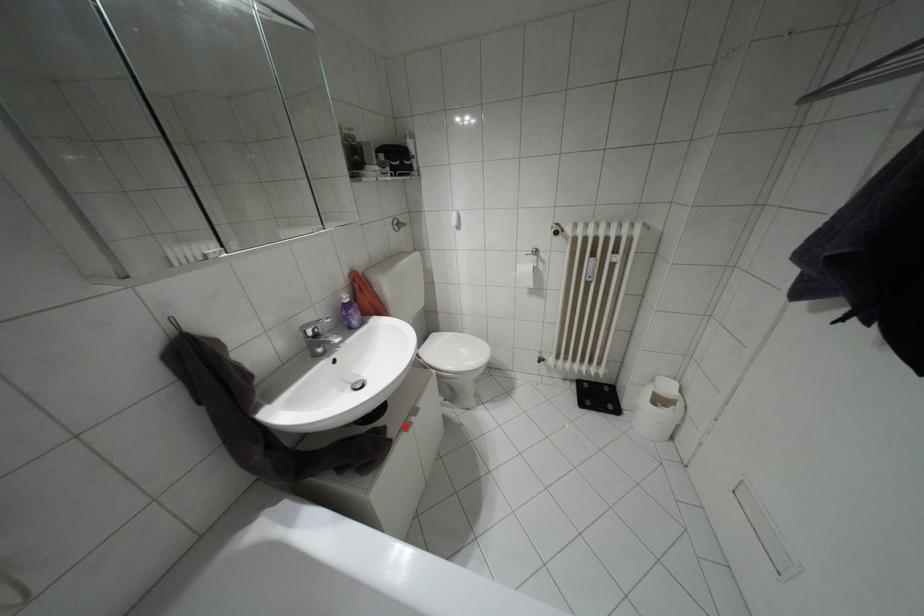
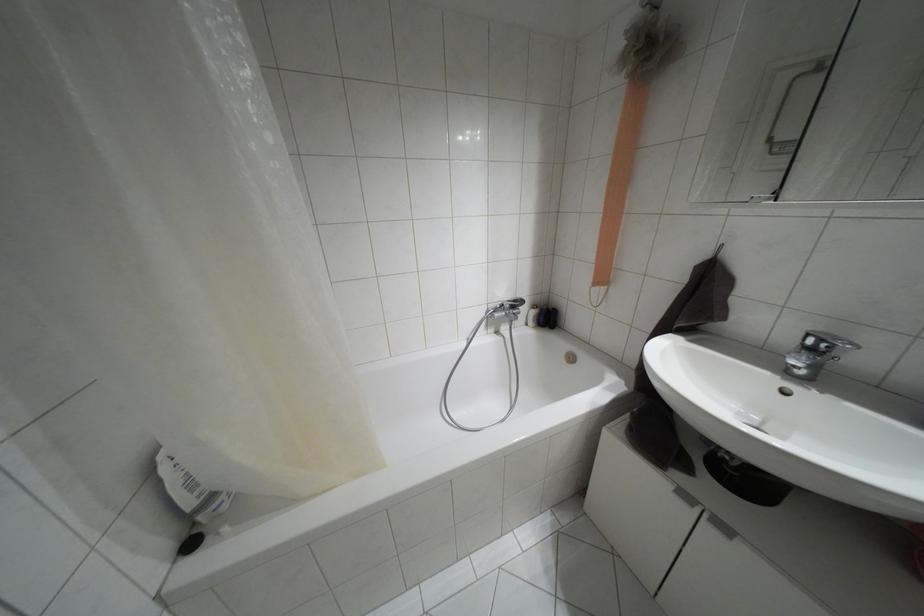
Where in the second image is the point corresponding to the highlighted location from the first image?

(685, 496)